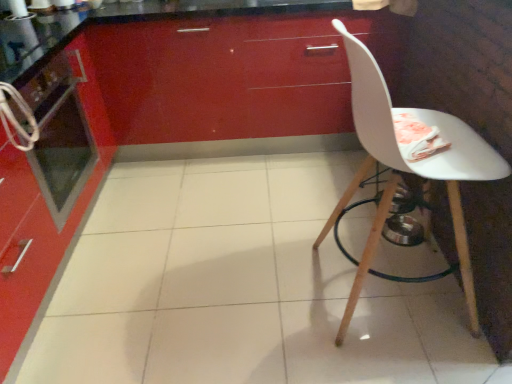
Describe the element at coordinates (62, 152) in the screenshot. The image size is (512, 384). I see `metallic oven at left` at that location.

Locate an element on the screen. white matte chair at right is located at coordinates (409, 165).

From the image's perspective, relative to glossy red cabinet at upper center, is white matte chair at right above or below?

Clearly, from the image's perspective, white matte chair at right is below glossy red cabinet at upper center.

Is white matte chair at right positioned behind glossy red cabinet at upper center?

No.

Considering the relative sizes of white matte chair at right and glossy red cabinet at upper center in the image provided, is white matte chair at right smaller than glossy red cabinet at upper center?

Yes, white matte chair at right is smaller than glossy red cabinet at upper center.

Is white matte chair at right positioned beyond the bounds of glossy red cabinet at upper center?

Yes, white matte chair at right is located beyond the bounds of glossy red cabinet at upper center.

Is metallic oven at left surrounded by glossy red cabinet at upper center?

No, glossy red cabinet at upper center does not contain metallic oven at left.

Considering their positions, is glossy red cabinet at upper center located in front of or behind metallic oven at left?

glossy red cabinet at upper center is positioned farther from the viewer than metallic oven at left.

Between glossy red cabinet at upper center and metallic oven at left, which one has smaller width?

With smaller width is metallic oven at left.

Can you confirm if white matte chair at right is smaller than metallic oven at left?

No, white matte chair at right is not smaller than metallic oven at left.

Which is behind, white matte chair at right or metallic oven at left?

metallic oven at left is further from the camera.

Are white matte chair at right and metallic oven at left making contact?

No, white matte chair at right is not touching metallic oven at left.

From the image's perspective, is white matte chair at right beneath metallic oven at left?

Yes.

From a real-world perspective, is glossy red cabinet at upper center positioned above or below white matte chair at right?

In terms of real-world spatial position, glossy red cabinet at upper center is below white matte chair at right.

Is glossy red cabinet at upper center bigger than white matte chair at right?

Correct, glossy red cabinet at upper center is larger in size than white matte chair at right.

From the picture: Which object is thinner, glossy red cabinet at upper center or white matte chair at right?

white matte chair at right.

In order to click on cabinetry on the left of the white matte chair at right in this screenshot , I will do `click(233, 73)`.

Are metallic oven at left and white matte chair at right far apart?

metallic oven at left is far away from white matte chair at right.

From the image's perspective, who appears lower, metallic oven at left or white matte chair at right?

white matte chair at right is shown below in the image.

Would you say metallic oven at left is to the left or to the right of white matte chair at right in the picture?

Based on their positions, metallic oven at left is located to the left of white matte chair at right.

From a real-world perspective, is metallic oven at left physically located above or below white matte chair at right?

Clearly, from a real-world perspective, metallic oven at left is above white matte chair at right.

Can you tell me how much metallic oven at left and glossy red cabinet at upper center differ in facing direction?

89.1 degrees.

Can you confirm if metallic oven at left is bigger than glossy red cabinet at upper center?

Actually, metallic oven at left might be smaller than glossy red cabinet at upper center.

At what (x,y) coordinates should I click in order to perform the action: click on cabinetry located on the right of metallic oven at left. Please return your answer as a coordinate pair (x, y). Looking at the image, I should click on (233, 73).

Identify the location of cabinetry below the white matte chair at right (from a real-world perspective). (233, 73).

This screenshot has height=384, width=512. In order to click on cabinetry on the right of metallic oven at left in this screenshot , I will do `click(233, 73)`.

From the image, which object appears to be nearer to metallic oven at left, glossy red cabinet at upper center or white matte chair at right?

glossy red cabinet at upper center lies closer to metallic oven at left than the other object.

Estimate the real-world distances between objects in this image. Which object is further from glossy red cabinet at upper center, white matte chair at right or metallic oven at left?

white matte chair at right is positioned further to the anchor glossy red cabinet at upper center.

Considering their positions, is glossy red cabinet at upper center positioned closer to white matte chair at right than metallic oven at left?

Based on the image, glossy red cabinet at upper center appears to be nearer to white matte chair at right.

From the image, which object appears to be nearer to metallic oven at left, white matte chair at right or glossy red cabinet at upper center?

glossy red cabinet at upper center is closer to metallic oven at left.

Based on their spatial positions, is metallic oven at left or white matte chair at right closer to glossy red cabinet at upper center?

Among the two, metallic oven at left is located nearer to glossy red cabinet at upper center.

Which object lies further to the anchor point white matte chair at right, metallic oven at left or glossy red cabinet at upper center?

metallic oven at left is positioned further to the anchor white matte chair at right.

I want to click on cabinetry between metallic oven at left and white matte chair at right from left to right, so click(x=233, y=73).